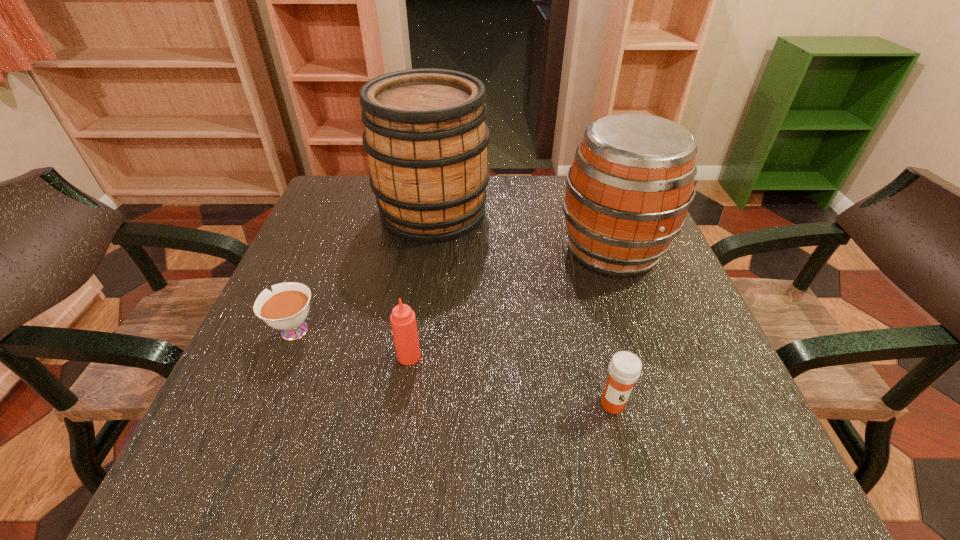
In the image, there is a desktop. At what (x,y) coordinates should I click in order to perform the action: click on free space at the far left corner. Please return your answer as a coordinate pair (x, y). Looking at the image, I should click on (352, 188).

Find the location of a particular element. free point between the Tabasco sauce and the left cider is located at coordinates (421, 284).

The height and width of the screenshot is (540, 960). I want to click on free point between the leftmost object and the right cider, so click(x=452, y=290).

Locate an element on the screen. This screenshot has width=960, height=540. free spot between the shortest object and the third shortest object is located at coordinates (350, 343).

Where is `unoccupied position between the medicine and the left cider`? unoccupied position between the medicine and the left cider is located at coordinates (523, 308).

Find the location of a particular element. This screenshot has height=540, width=960. free space between the right cider and the fourth tallest object is located at coordinates (612, 327).

In order to click on vacant area that lies between the left cider and the right cider in this screenshot , I will do `click(523, 231)`.

Where is `vacant area that lies between the right cider and the left cider`? vacant area that lies between the right cider and the left cider is located at coordinates (523, 231).

This screenshot has height=540, width=960. I want to click on unoccupied position between the third shortest object and the left cider, so click(421, 284).

The height and width of the screenshot is (540, 960). What are the coordinates of `vacant space in between the third tallest object and the leftmost object` in the screenshot? It's located at (350, 343).